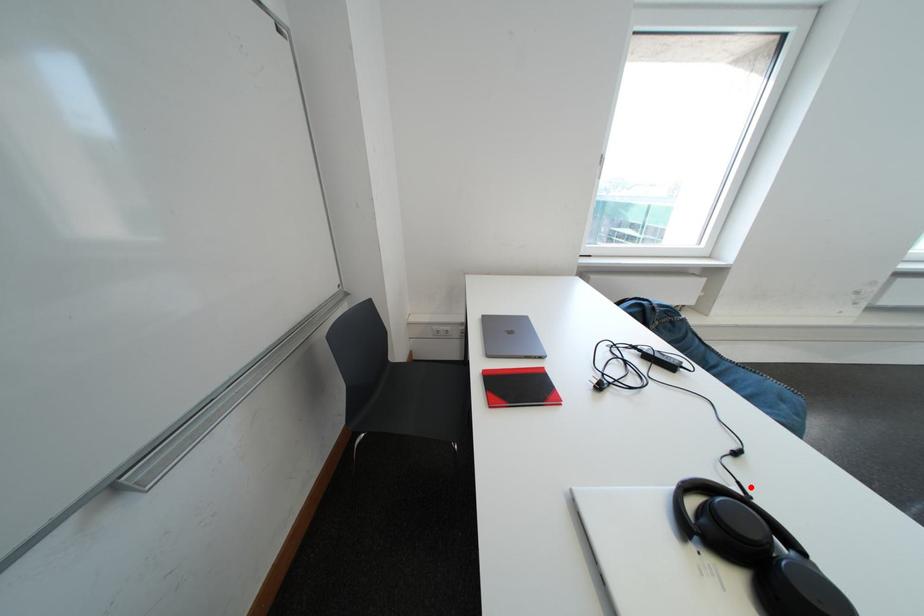
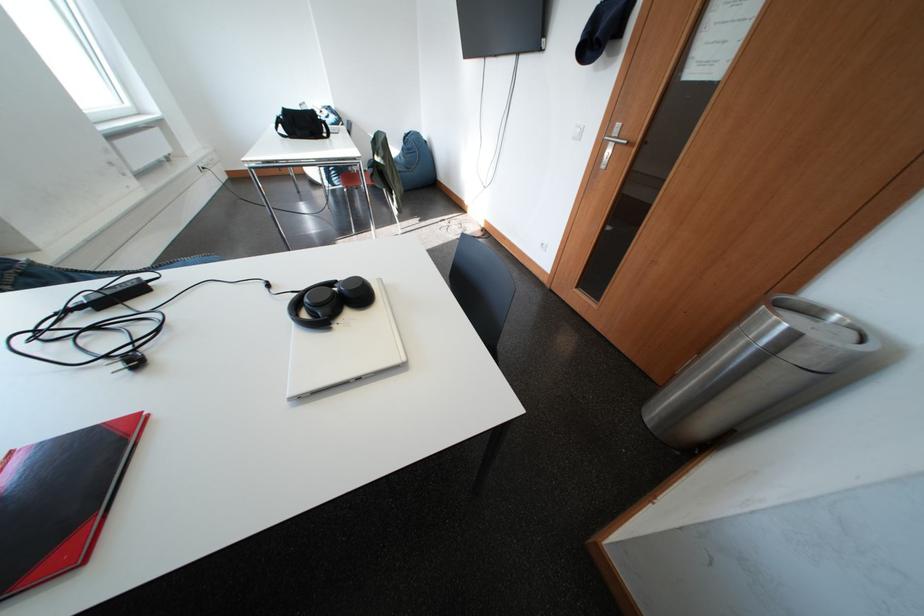
Locate, in the second image, the point that corresponds to the highlighted location in the first image.

(304, 294)